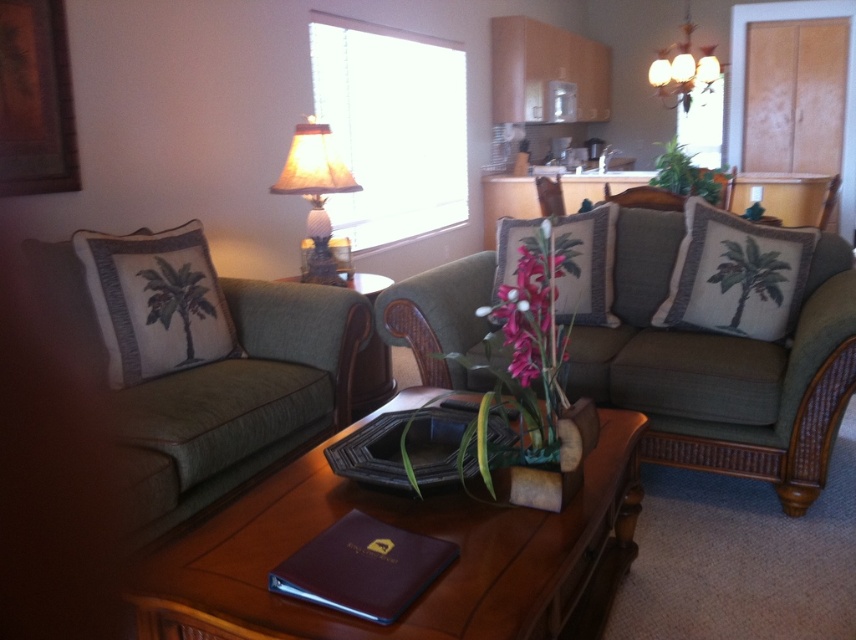
You are a delivery robot with a package that is 1.2 meters wide. You need to place it on the brown wood table at center. Can you fit the package on the table without it hanging over the edges?

The distance between the brown wood table at center and the camera is 1.20 meters, but this does not provide information about the table size. Therefore, it is uncertain if the package will fit.